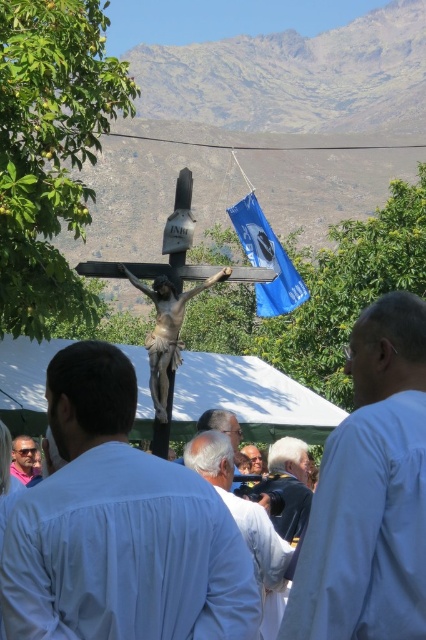
Question: Is gray hair at center smaller than smooth skin face at center?

Choices:
 (A) no
 (B) yes

Answer: (A)

Question: Which of these objects is positioned closest to the white matte shirt at right?

Choices:
 (A) wooden crucifix at center
 (B) blue fabric flag at upper center

Answer: (A)

Question: Considering the real-world distances, which object is farthest from the smooth skin face at center?

Choices:
 (A) white cotton shirt at center
 (B) gray hair at center
 (C) blue fabric flag at upper center

Answer: (A)

Question: Among these points, which one is farthest from the camera?

Choices:
 (A) (340, 476)
 (B) (229, 426)
 (C) (37, 632)
 (D) (31, 480)

Answer: (D)

Question: Can you confirm if white matte shirt at right is smaller than pink fabric sunglasses at lower left?

Choices:
 (A) no
 (B) yes

Answer: (A)

Question: Is white fabric canopy at center above blue fabric flag at upper center?

Choices:
 (A) no
 (B) yes

Answer: (A)